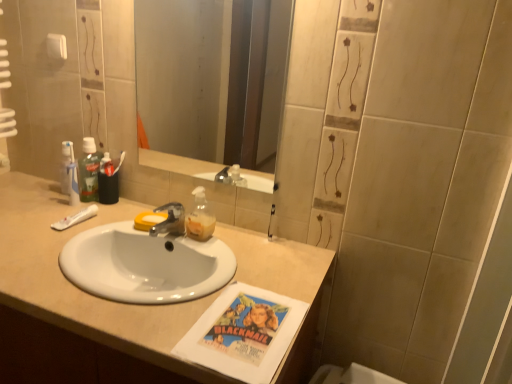
Question: Does metallic silver faucet at center have a greater width compared to translucent plastic soap dispenser at center?

Choices:
 (A) no
 (B) yes

Answer: (B)

Question: Considering the relative sizes of metallic silver faucet at center and translucent plastic soap dispenser at center in the image provided, is metallic silver faucet at center shorter than translucent plastic soap dispenser at center?

Choices:
 (A) no
 (B) yes

Answer: (B)

Question: Does metallic silver faucet at center appear on the left side of translucent plastic soap dispenser at center?

Choices:
 (A) no
 (B) yes

Answer: (B)

Question: Is metallic silver faucet at center outside translucent plastic soap dispenser at center?

Choices:
 (A) no
 (B) yes

Answer: (B)

Question: Could you tell me if metallic silver faucet at center is facing translucent plastic soap dispenser at center?

Choices:
 (A) no
 (B) yes

Answer: (A)

Question: Can you confirm if metallic silver faucet at center is taller than translucent plastic soap dispenser at center?

Choices:
 (A) yes
 (B) no

Answer: (B)

Question: Is the position of smooth glass mirror at center more distant than that of white glossy sink at center?

Choices:
 (A) yes
 (B) no

Answer: (A)

Question: Can you confirm if smooth glass mirror at center is smaller than white glossy sink at center?

Choices:
 (A) no
 (B) yes

Answer: (B)

Question: Would you say smooth glass mirror at center is outside white glossy sink at center?

Choices:
 (A) yes
 (B) no

Answer: (A)

Question: From a real-world perspective, is smooth glass mirror at center on top of white glossy sink at center?

Choices:
 (A) no
 (B) yes

Answer: (B)

Question: Does smooth glass mirror at center come in front of white glossy sink at center?

Choices:
 (A) no
 (B) yes

Answer: (A)

Question: Does smooth glass mirror at center have a lesser height compared to white glossy sink at center?

Choices:
 (A) no
 (B) yes

Answer: (B)

Question: From the image's perspective, would you say white matte toothpaste at left is shown under white glossy sink at center?

Choices:
 (A) yes
 (B) no

Answer: (B)